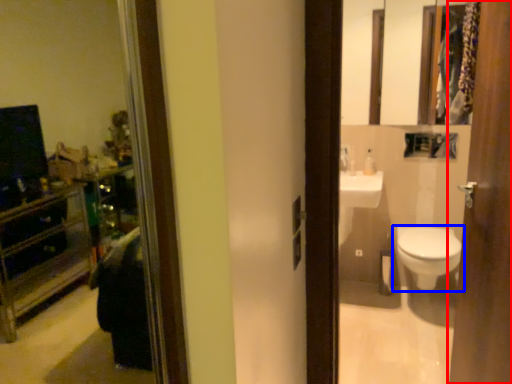
Question: Which point is closer to the camera, door (highlighted by a red box) or toilet (highlighted by a blue box)?

Choices:
 (A) door
 (B) toilet

Answer: (A)